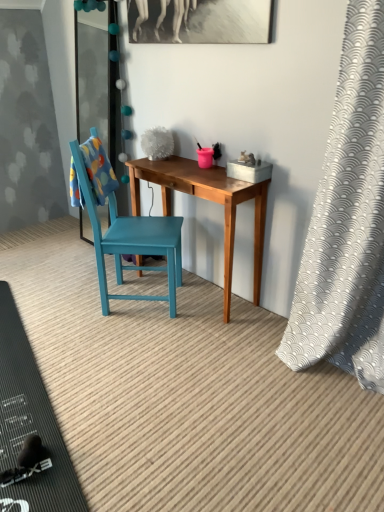
Where is `free space to the left of teal wooden chair at center`? free space to the left of teal wooden chair at center is located at coordinates (66, 300).